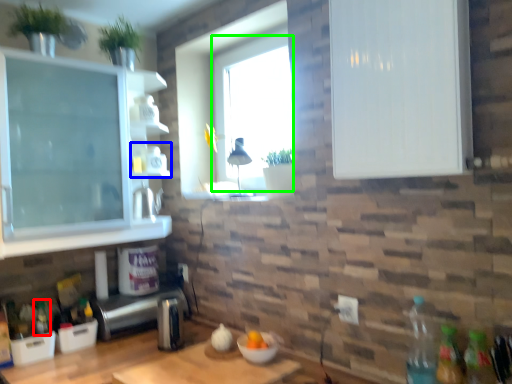
Question: Based on their relative distances, which object is farther from bottle (highlighted by a red box)? Choose from shelf (highlighted by a blue box) and window screen (highlighted by a green box).

Choices:
 (A) shelf
 (B) window screen

Answer: (B)